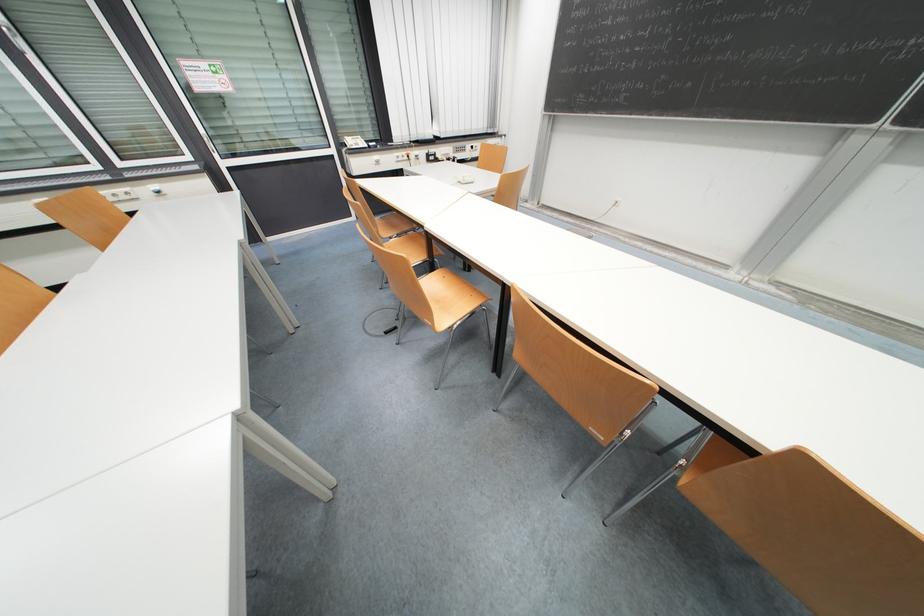
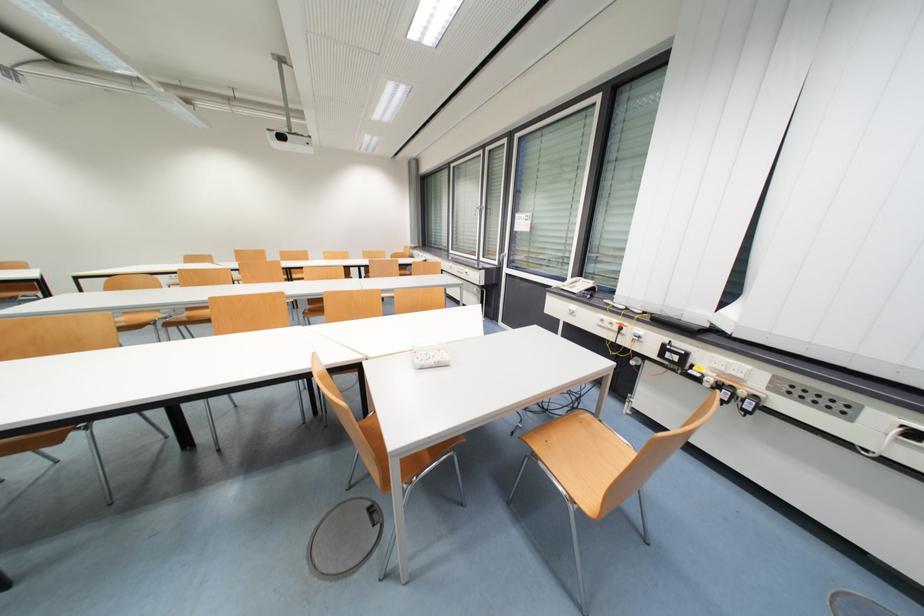
The point at (409, 155) is marked in the first image. Where is the corresponding point in the second image?

(622, 323)